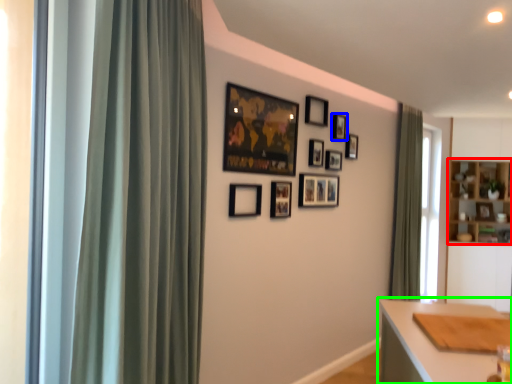
Question: Which is farther away from cabinetry (highlighted by a red box)? picture frame (highlighted by a blue box) or table (highlighted by a green box)?

Choices:
 (A) picture frame
 (B) table

Answer: (B)